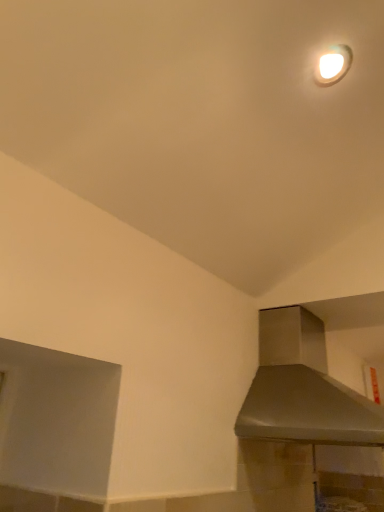
Locate an element on the screen. The image size is (384, 512). metallic gray vent at lower right is located at coordinates (303, 388).

The width and height of the screenshot is (384, 512). What do you see at coordinates (303, 388) in the screenshot?
I see `metallic gray vent at lower right` at bounding box center [303, 388].

Locate an element on the screen. The height and width of the screenshot is (512, 384). metallic gray vent at lower right is located at coordinates (303, 388).